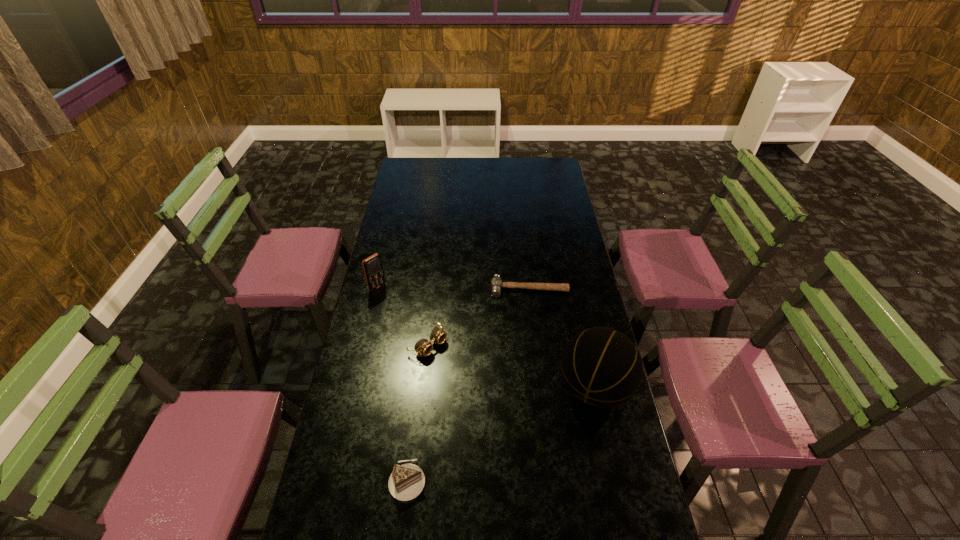
Find the location of `vacant space on the desktop that is between the chocolate cake and the tallest object and is positioned through the lenses of the goggles`. vacant space on the desktop that is between the chocolate cake and the tallest object and is positioned through the lenses of the goggles is located at coordinates (530, 420).

Locate an element on the screen. vacant space on the desktop that is between the chocolate cake and the tallest object and is positioned on the screen of the leftmost object is located at coordinates (533, 418).

Where is `vacant space on the desktop that is between the chocolate cake and the basketball and is positioned on the striking face of the shortest object`? The image size is (960, 540). vacant space on the desktop that is between the chocolate cake and the basketball and is positioned on the striking face of the shortest object is located at coordinates (532, 419).